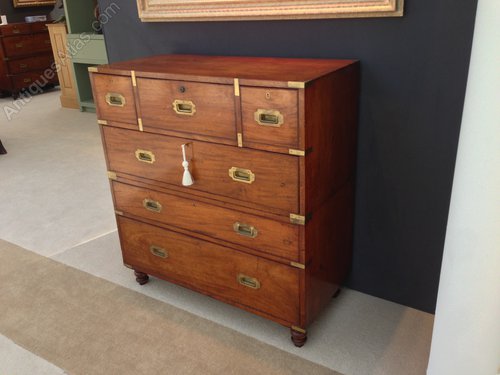
This screenshot has width=500, height=375. What are the coordinates of `handle` in the screenshot? It's located at (159, 254).